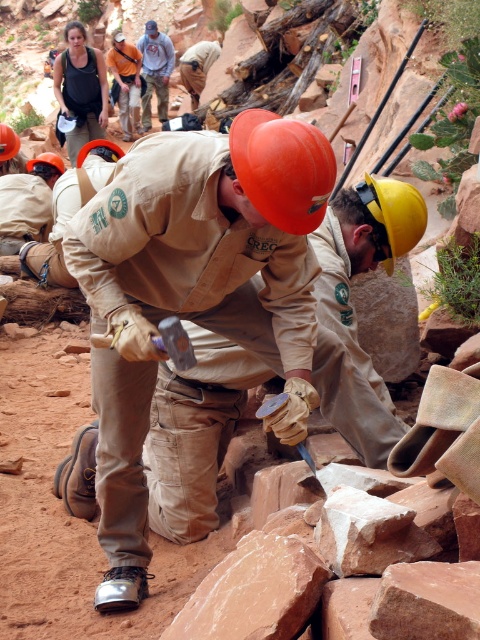
Is yellow matte helmet at center wider than matte orange helmet at center?

No.

Measure the distance between point (x=368, y=177) and camera.

10.82 feet

The width and height of the screenshot is (480, 640). I want to click on yellow matte helmet at center, so click(x=395, y=212).

Does matte black tank top at upper left appear on the right side of orange matte helmet at upper center?

Correct, you'll find matte black tank top at upper left to the right of orange matte helmet at upper center.

Can you confirm if matte black tank top at upper left is positioned to the left of orange matte helmet at upper center?

In fact, matte black tank top at upper left is to the right of orange matte helmet at upper center.

Who is more forward, (86, 74) or (12, 145)?

Point (12, 145)

This screenshot has width=480, height=640. Find the location of `matte black tank top at upper left`. matte black tank top at upper left is located at coordinates (80, 90).

Does orange hard hat at center have a greater width compared to matte orange helmet at center?

Incorrect, orange hard hat at center's width does not surpass matte orange helmet at center's.

Who is more distant from viewer, [276,192] or [82,157]?

Point [82,157]

Find the location of a particular element. The image size is (480, 640). orange hard hat at center is located at coordinates (283, 168).

This screenshot has height=640, width=480. In order to click on orange hard hat at center in this screenshot , I will do `click(283, 168)`.